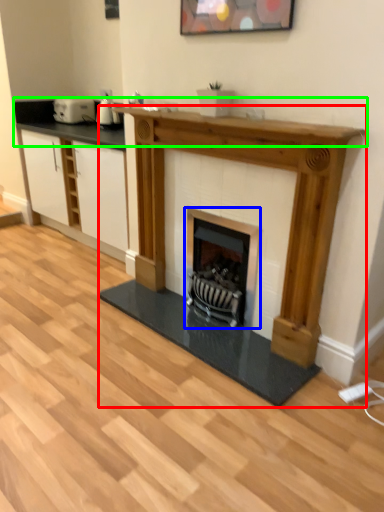
Question: Considering the real-world distances, which object is farthest from fireplace (highlighted by a red box)? wood burning stove (highlighted by a blue box) or counter top (highlighted by a green box)?

Choices:
 (A) wood burning stove
 (B) counter top

Answer: (B)